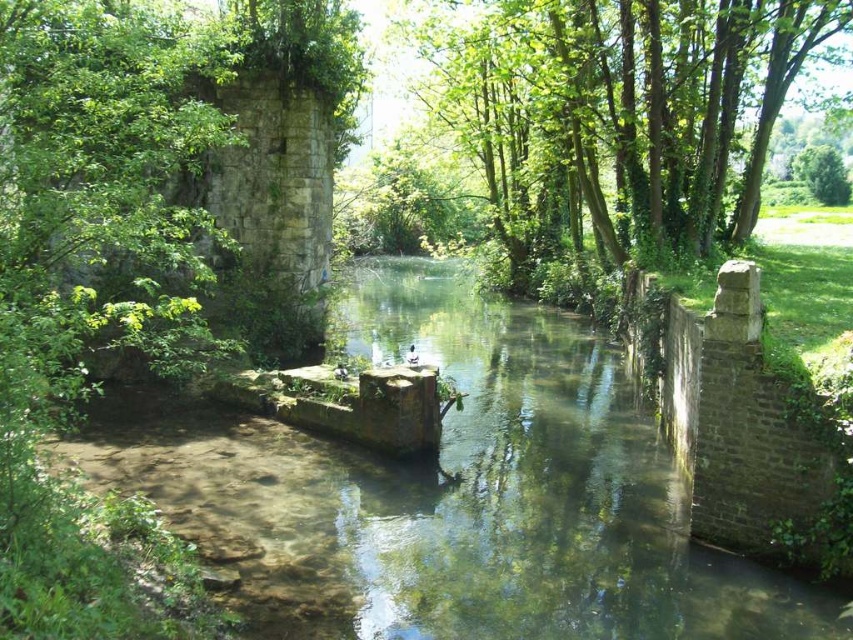
You are standing at point (451, 493) in the serene natural scene. What is located exactly at your current position?

At point (451, 493) lies the clear stone river at center.

You are standing in the middle of the clear stone river at center and want to reach the green leafy tree at upper center. Which direction should you move to get closer to the tree?

You should move upward because the clear stone river at center is below the green leafy tree at upper center.